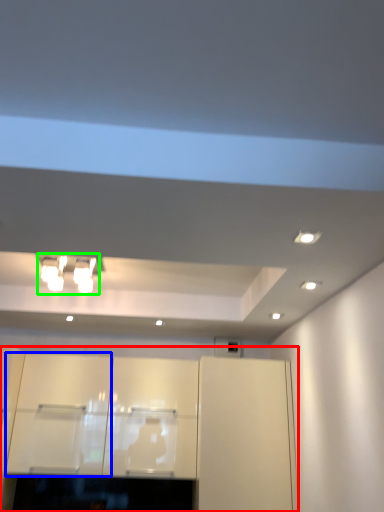
Question: Which object is the farthest from cabinetry (highlighted by a red box)? Choose among these: cabinetry (highlighted by a blue box) or light fixture (highlighted by a green box).

Choices:
 (A) cabinetry
 (B) light fixture

Answer: (B)